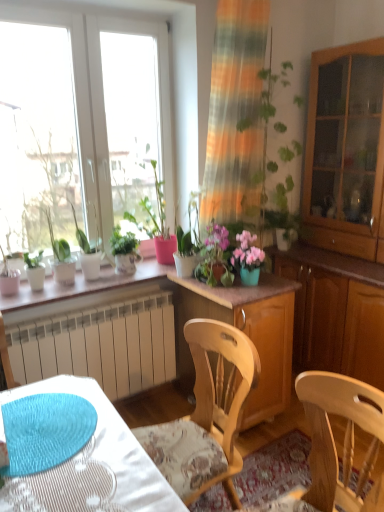
You are a GUI agent. You are given a task and a screenshot of the screen. Output one action in this format:
    pyautogui.click(x=<x>, y=<y>)
    Task: Click on the green matte plant at left, acting as the 1th houseplant starting from the left
    The image size is (384, 512).
    Given the screenshot: What is the action you would take?
    click(61, 257)

Image resolution: width=384 pixels, height=512 pixels. What are the coordinates of `wooden cabinet at center, the 1th cabinetry positioned from the bottom` in the screenshot? It's located at (245, 333).

Find the location of a particular element. The height and width of the screenshot is (512, 384). green matte plant at upper left, positioned as the 2th houseplant in left-to-right order is located at coordinates (88, 252).

In order to face wooden cabinet at right, the 1th cabinetry from the right, should I rotate leftwards or rightwards?

You should look right and rotate roughly 21.612 degrees.

What is the approximate width of pink matte floral arrangement at center?

pink matte floral arrangement at center is 9.11 inches wide.

Identify the location of green matte plant at left, acting as the 1th houseplant starting from the left. (61, 257).

Which point is more distant from viewer, (82, 266) or (65, 282)?

Positioned behind is point (82, 266).

Is green matte plant at upper left, positioned as the 2th houseplant in left-to-right order, next to green matte plant at left, which is the second houseplant in right-to-left order, and touching it?

There is a gap between green matte plant at upper left, positioned as the 2th houseplant in left-to-right order, and green matte plant at left, which is the second houseplant in right-to-left order.

From a real-world perspective, is green matte plant at upper left, the 1th houseplant from the right, beneath green matte plant at left, which is the second houseplant in right-to-left order?

Incorrect, from a real-world perspective, green matte plant at upper left, the 1th houseplant from the right, is higher than green matte plant at left, which is the second houseplant in right-to-left order.

Is green matte plant at upper left, the 1th houseplant from the right, facing away from green matte plant at left, acting as the 1th houseplant starting from the left?

No.

Does wooden chair at center come in front of white lace tablecloth at lower left?

No, it is behind white lace tablecloth at lower left.

Does wooden chair at center have a lesser height compared to white lace tablecloth at lower left?

Incorrect, the height of wooden chair at center does not fall short of that of white lace tablecloth at lower left.

Where is `chair located below the white lace tablecloth at lower left (from the image's perspective)`? chair located below the white lace tablecloth at lower left (from the image's perspective) is located at coordinates (206, 415).

Is wooden chair at center positioned far away from white lace tablecloth at lower left?

That's not correct — wooden chair at center is a little close to white lace tablecloth at lower left.

Which is correct: pink matte flower pot at center is inside green matte plant at upper left, positioned as the 2th houseplant in left-to-right order, or outside of it?

pink matte flower pot at center is outside green matte plant at upper left, positioned as the 2th houseplant in left-to-right order.

Is pink matte flower pot at center oriented towards green matte plant at upper left, the 1th houseplant from the right?

No, pink matte flower pot at center is not turned towards green matte plant at upper left, the 1th houseplant from the right.

Is pink matte flower pot at center placed right next to green matte plant at upper left, the 1th houseplant from the right?

No, pink matte flower pot at center is not beside green matte plant at upper left, the 1th houseplant from the right.

Measure the distance between pink matte flower pot at center and green matte plant at upper left, the 1th houseplant from the right.

pink matte flower pot at center is 35.77 inches away from green matte plant at upper left, the 1th houseplant from the right.

Considering the relative sizes of wooden cabinet at right, which is the 1th cabinetry from top to bottom, and white lace tablecloth at lower left in the image provided, is wooden cabinet at right, which is the 1th cabinetry from top to bottom, wider than white lace tablecloth at lower left?

No.

Between point (348, 120) and point (123, 463), which one is positioned in front?

The point (123, 463) is closer to the camera.

In terms of size, does wooden cabinet at right, the 1th cabinetry from the right, appear bigger or smaller than white lace tablecloth at lower left?

In the image, wooden cabinet at right, the 1th cabinetry from the right, appears to be larger than white lace tablecloth at lower left.

Looking at this image, visually, is wooden cabinet at right, which ranks as the 2th cabinetry in bottom-to-top order, positioned to the left or to the right of white lace tablecloth at lower left?

wooden cabinet at right, which ranks as the 2th cabinetry in bottom-to-top order, is positioned on white lace tablecloth at lower left's right side.

Is wooden chair at center far from pink matte floral arrangement at center?

No, wooden chair at center is not far from pink matte floral arrangement at center.

Does wooden chair at center turn towards pink matte floral arrangement at center?

No, wooden chair at center is not facing towards pink matte floral arrangement at center.

Between wooden chair at center and pink matte floral arrangement at center, which one is positioned behind?

pink matte floral arrangement at center is further away from the camera.

Between wooden chair at center and pink matte floral arrangement at center, which one has larger size?

Bigger between the two is wooden chair at center.

Is pink matte flower pot at center next to white lace tablecloth at lower left?

pink matte flower pot at center and white lace tablecloth at lower left are clearly separated.

Is pink matte flower pot at center looking in the opposite direction of white lace tablecloth at lower left?

No, pink matte flower pot at center is not facing the opposite direction of white lace tablecloth at lower left.

Which object is thinner, pink matte flower pot at center or white lace tablecloth at lower left?

pink matte flower pot at center is thinner.

Is pink matte flower pot at center not inside white lace tablecloth at lower left?

Yes, pink matte flower pot at center is not within white lace tablecloth at lower left.

Measure the distance between wooden chair at center and wooden cabinet at right.

The distance of wooden chair at center from wooden cabinet at right is 1.16 meters.

Is point (160, 434) closer to viewer compared to point (382, 334)?

Yes, it is in front of point (382, 334).

Consider the image. Between wooden chair at center and wooden cabinet at right, which one has less height?

Standing shorter between the two is wooden cabinet at right.

At what (x,y) coordinates should I click in order to perform the action: click on dresser above the wooden chair at center (from the image's perspective). Please return your answer as a coordinate pair (x, y). The width and height of the screenshot is (384, 512). Looking at the image, I should click on (335, 312).

You are a GUI agent. You are given a task and a screenshot of the screen. Output one action in this format:
    pyautogui.click(x=<x>, y=<y>)
    Task: Click on the houseplant that appears behind the green matte plant at left, which is the second houseplant in right-to-left order
    The width and height of the screenshot is (384, 512).
    Given the screenshot: What is the action you would take?
    [x=88, y=252]

Identify the location of desk on the left of the wooden chair at center. Image resolution: width=384 pixels, height=512 pixels. (91, 465).

When comparing their distances from white lace tablecloth at lower left, does wooden cabinet at right or green matte plant at upper left, the 1th houseplant from the right, seem closer?

green matte plant at upper left, the 1th houseplant from the right.

From the picture: Which object lies further to the anchor point green matte plant at upper left, positioned as the 2th houseplant in left-to-right order, white lace tablecloth at lower left or wooden cabinet at right?

wooden cabinet at right is further to green matte plant at upper left, positioned as the 2th houseplant in left-to-right order.

Looking at the image, which one is located further to white lace tablecloth at lower left, wooden cabinet at right, the second cabinetry positioned from the left, or pink matte flower pot at center?

Among the two, wooden cabinet at right, the second cabinetry positioned from the left, is located further to white lace tablecloth at lower left.

When comparing their distances from wooden cabinet at right, does white lace tablecloth at lower left or green matte plant at upper left, positioned as the 2th houseplant in left-to-right order, seem further?

The object further to wooden cabinet at right is white lace tablecloth at lower left.

Estimate the real-world distances between objects in this image. Which object is further from pink matte floral arrangement at center, green matte plant at upper left, positioned as the 2th houseplant in left-to-right order, or wooden chair at center?

green matte plant at upper left, positioned as the 2th houseplant in left-to-right order, is positioned further to the anchor pink matte floral arrangement at center.

Estimate the real-world distances between objects in this image. Which object is further from white lace tablecloth at lower left, pink matte floral arrangement at center or green matte plant at left, acting as the 1th houseplant starting from the left?

green matte plant at left, acting as the 1th houseplant starting from the left, is further to white lace tablecloth at lower left.

Which object lies further to the anchor point wooden cabinet at right, green matte plant at upper left, the 1th houseplant from the right, or wooden cabinet at right, which is the 1th cabinetry from top to bottom?

green matte plant at upper left, the 1th houseplant from the right, lies further to wooden cabinet at right than the other object.

When comparing their distances from pink matte floral arrangement at center, does wooden cabinet at right, which is the 1th cabinetry from top to bottom, or green matte plant at left, acting as the 1th houseplant starting from the left, seem closer?

green matte plant at left, acting as the 1th houseplant starting from the left, is positioned closer to the anchor pink matte floral arrangement at center.

Where is `floral arrangement between wooden chair at center and wooden cabinet at right in the horizontal direction`? The image size is (384, 512). floral arrangement between wooden chair at center and wooden cabinet at right in the horizontal direction is located at coordinates (227, 256).

Where is `flower located between green matte plant at upper left, the 1th houseplant from the right, and wooden cabinet at right in the left-right direction`? This screenshot has width=384, height=512. flower located between green matte plant at upper left, the 1th houseplant from the right, and wooden cabinet at right in the left-right direction is located at coordinates (247, 252).

You are a GUI agent. You are given a task and a screenshot of the screen. Output one action in this format:
    pyautogui.click(x=<x>, y=<y>)
    Task: Click on the floral arrangement located between green matte plant at upper left, positioned as the 2th houseplant in left-to-right order, and wooden cabinet at right, which ranks as the 2th cabinetry in bottom-to-top order, in the left-right direction
    This screenshot has height=512, width=384.
    Given the screenshot: What is the action you would take?
    pyautogui.click(x=227, y=256)

Where is `houseplant located between white lace tablecloth at lower left and green matte plant at upper left, the 1th houseplant from the right, in the depth direction`? The height and width of the screenshot is (512, 384). houseplant located between white lace tablecloth at lower left and green matte plant at upper left, the 1th houseplant from the right, in the depth direction is located at coordinates (61, 257).